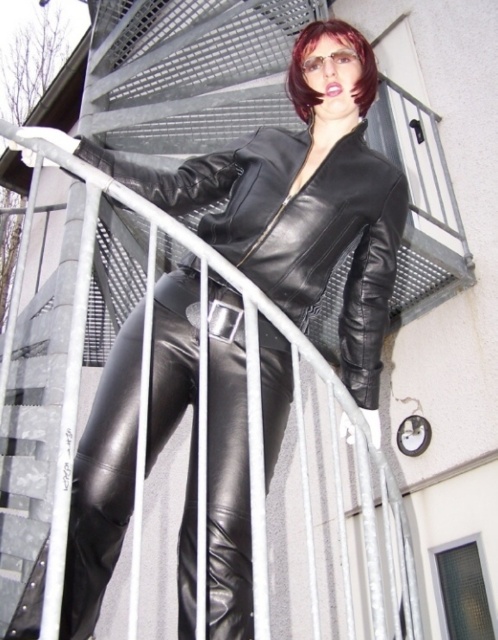
Question: Which is nearer to the black leather jacket at center?

Choices:
 (A) black leather boot at lower left
 (B) shiny dark brown hair at center

Answer: (B)

Question: Can you confirm if black leather jacket at center is positioned to the right of black leather boot at lower left?

Choices:
 (A) yes
 (B) no

Answer: (A)

Question: Among these objects, which one is nearest to the camera?

Choices:
 (A) shiny dark brown hair at center
 (B) black leather jacket at center

Answer: (B)

Question: Does black leather boot at lower left have a smaller size compared to shiny dark brown hair at center?

Choices:
 (A) no
 (B) yes

Answer: (B)

Question: Which object appears closest to the camera in this image?

Choices:
 (A) black leather jacket at center
 (B) black leather boot at lower left
 (C) shiny dark brown hair at center

Answer: (B)

Question: Does black leather boot at lower left have a lesser width compared to shiny dark brown hair at center?

Choices:
 (A) yes
 (B) no

Answer: (A)